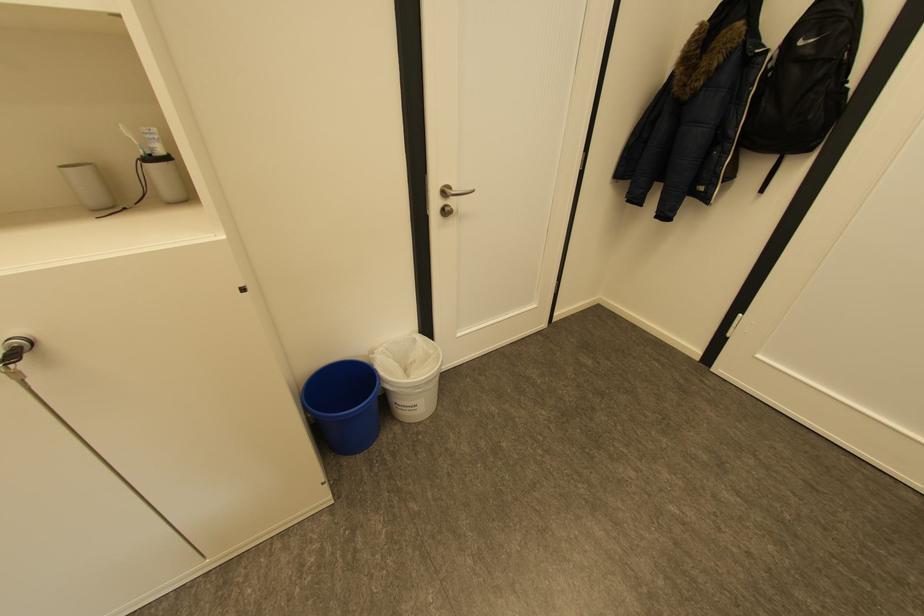
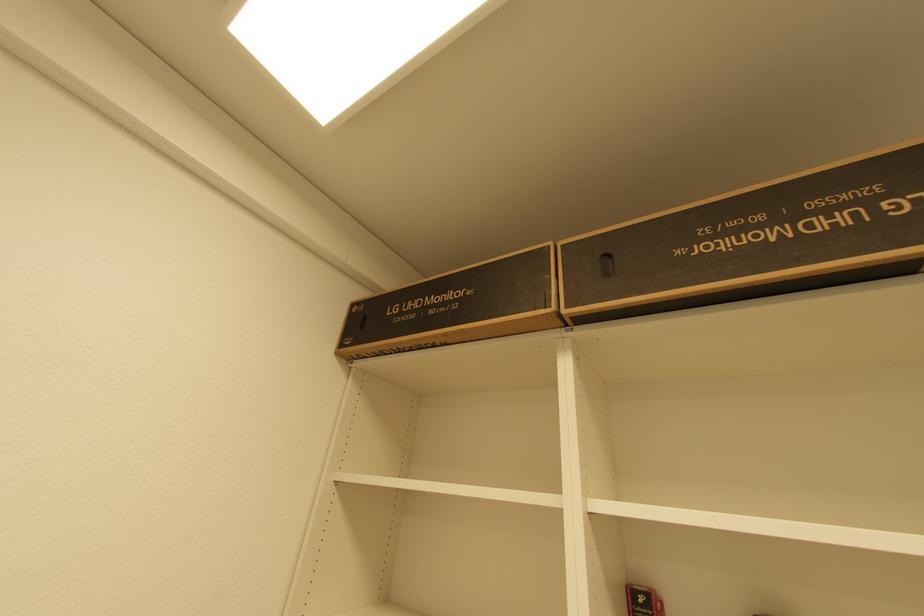
First-person continuous shooting, in which direction is the camera rotating?

The rotation direction of the camera is left-up.